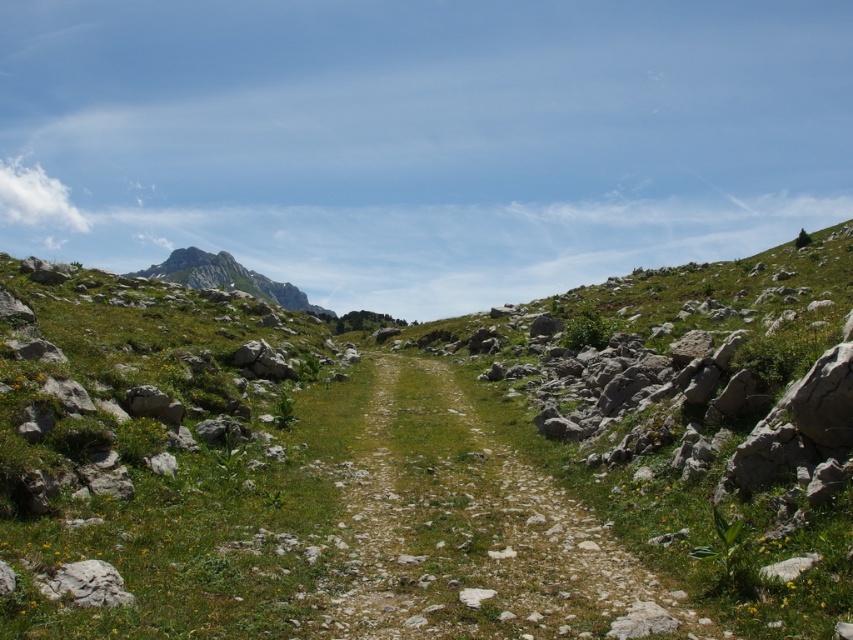
Consider the image. Is green grassy at center thinner than rugged granite mountain at upper left?

Correct, green grassy at center's width is less than rugged granite mountain at upper left's.

Is point (201, 428) less distant than point (297, 298)?

That is True.

I want to click on green grassy at center, so pyautogui.click(x=421, y=461).

How distant is rugged granite mountain at upper left from gray rough rock at lower left?

rugged granite mountain at upper left and gray rough rock at lower left are 736.64 meters apart.

Which is in front, point (187, 280) or point (97, 593)?

Point (97, 593) is more forward.

Does point (177, 252) lie in front of point (77, 577)?

No.

Find the location of `rugged granite mountain at upper left`. rugged granite mountain at upper left is located at coordinates point(225,276).

Which is behind, point (596, 396) or point (125, 598)?

The point (596, 396) is more distant.

The image size is (853, 640). Find the location of `green grassy at center`. green grassy at center is located at coordinates (421, 461).

Between point (48, 308) and point (103, 570), which one is positioned behind?

The point (48, 308) is more distant.

You are a GUI agent. You are given a task and a screenshot of the screen. Output one action in this format:
    pyautogui.click(x=<x>, y=<y>)
    Task: Click on the green grassy at center
    
    Given the screenshot: What is the action you would take?
    pyautogui.click(x=421, y=461)